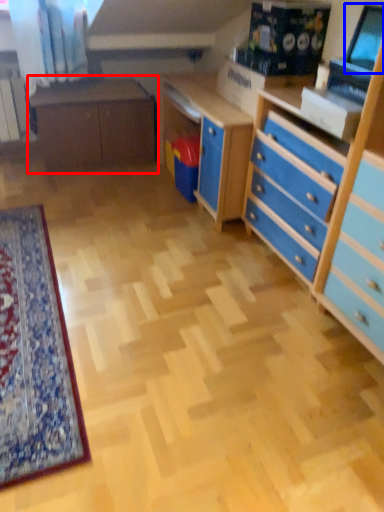
Question: Among these objects, which one is farthest to the camera, table (highlighted by a red box) or computer monitor (highlighted by a blue box)?

Choices:
 (A) table
 (B) computer monitor

Answer: (A)